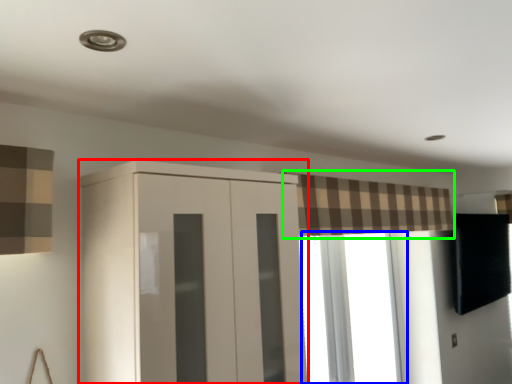
Question: Based on their relative distances, which object is farther from cupboard (highlighted by a red box)? Choose from window (highlighted by a blue box) and curtain (highlighted by a green box).

Choices:
 (A) window
 (B) curtain

Answer: (A)